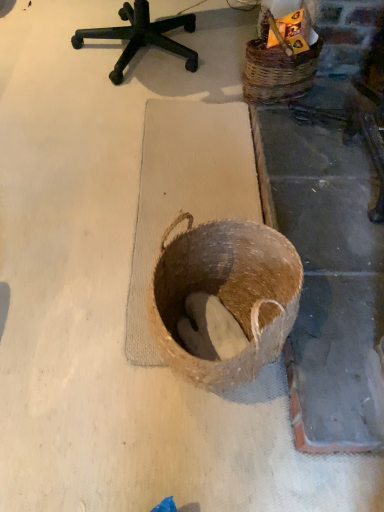
Where is `free space in front of brown woven basket at center, which ranks as the 1th basket in bottom-to-top order`? Image resolution: width=384 pixels, height=512 pixels. free space in front of brown woven basket at center, which ranks as the 1th basket in bottom-to-top order is located at coordinates (215, 460).